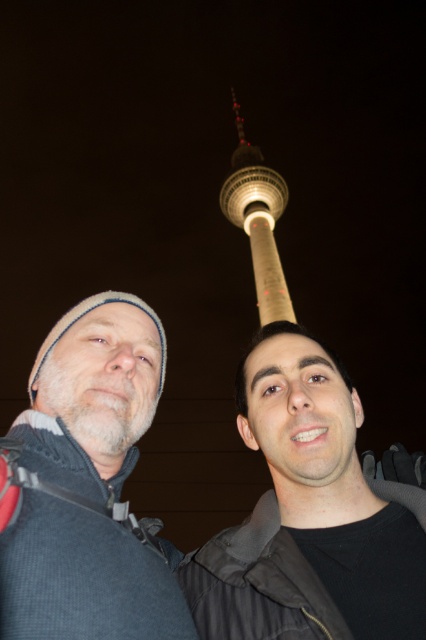
Can you confirm if dark gray knit hat at upper left is taller than white concrete tower at upper center?

No.

Is dark gray knit hat at upper left above white concrete tower at upper center?

No, dark gray knit hat at upper left is not above white concrete tower at upper center.

Image resolution: width=426 pixels, height=640 pixels. What do you see at coordinates (252, 531) in the screenshot? I see `dark gray knit hat at upper left` at bounding box center [252, 531].

The height and width of the screenshot is (640, 426). In order to click on dark gray knit hat at upper left in this screenshot , I will do `click(252, 531)`.

Does gray knit beanie at left appear under white concrete tower at upper center?

Indeed, gray knit beanie at left is positioned under white concrete tower at upper center.

Which of these two, gray knit beanie at left or white concrete tower at upper center, stands taller?

white concrete tower at upper center

Image resolution: width=426 pixels, height=640 pixels. What do you see at coordinates (86, 484) in the screenshot?
I see `gray knit beanie at left` at bounding box center [86, 484].

Identify the location of gray knit beanie at left. The height and width of the screenshot is (640, 426). (86, 484).

Does point (13, 612) come farther from viewer compared to point (0, 534)?

No, it is in front of (0, 534).

Which is in front, point (83, 490) or point (100, 460)?

Positioned in front is point (83, 490).

At what (x,y) coordinates should I click in order to perform the action: click on dark gray knit hat at upper left. Please return your answer as a coordinate pair (x, y). Looking at the image, I should click on (252, 531).